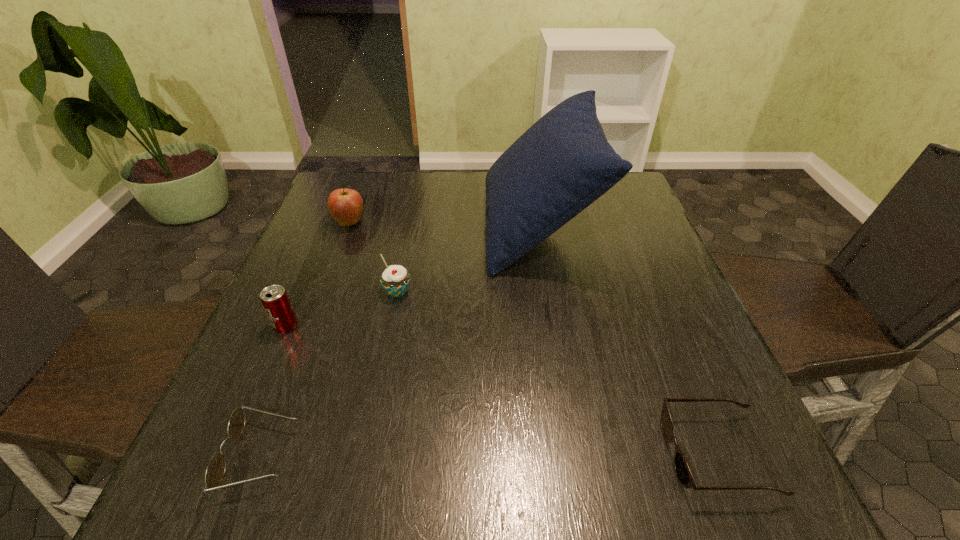
Locate an element on the screen. This screenshot has height=540, width=960. object located in the near right corner section of the desktop is located at coordinates (683, 472).

At what (x,y) coordinates should I click in order to perform the action: click on vacant space at the far edge of the desktop. Please return your answer as a coordinate pair (x, y). The width and height of the screenshot is (960, 540). Looking at the image, I should click on coord(453,210).

At what (x,y) coordinates should I click in order to perform the action: click on vacant area at the near edge. Please return your answer as a coordinate pair (x, y). Looking at the image, I should click on 373,462.

This screenshot has width=960, height=540. Find the location of `free space at the left edge of the desktop`. free space at the left edge of the desktop is located at coordinates (260, 352).

The width and height of the screenshot is (960, 540). I want to click on vacant space at the right edge, so click(623, 229).

This screenshot has height=540, width=960. What are the coordinates of `free point at the near left corner` in the screenshot? It's located at (210, 451).

You are a GUI agent. You are given a task and a screenshot of the screen. Output one action in this format:
    pyautogui.click(x=<x>, y=<y>)
    Task: Click on the vacant space at the far right corner of the desktop
    The width and height of the screenshot is (960, 540).
    Given the screenshot: What is the action you would take?
    pyautogui.click(x=619, y=201)

I want to click on vacant region at the near right corner of the desktop, so click(x=760, y=503).

You are a GUI agent. You are given a task and a screenshot of the screen. Output one action in this format:
    pyautogui.click(x=<x>, y=<y>)
    Task: Click on the blank region between the spectacles and the fourth farthest object
    The image size is (960, 540).
    Given the screenshot: What is the action you would take?
    pyautogui.click(x=274, y=391)

The width and height of the screenshot is (960, 540). I want to click on vacant space that is in between the fourth object from left to right and the spectacles, so click(329, 374).